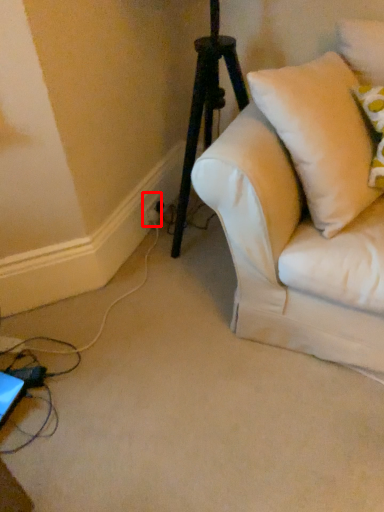
Question: From the image's perspective, where is electric outlet (annotated by the red box) located relative to pillow?

Choices:
 (A) above
 (B) below

Answer: (B)